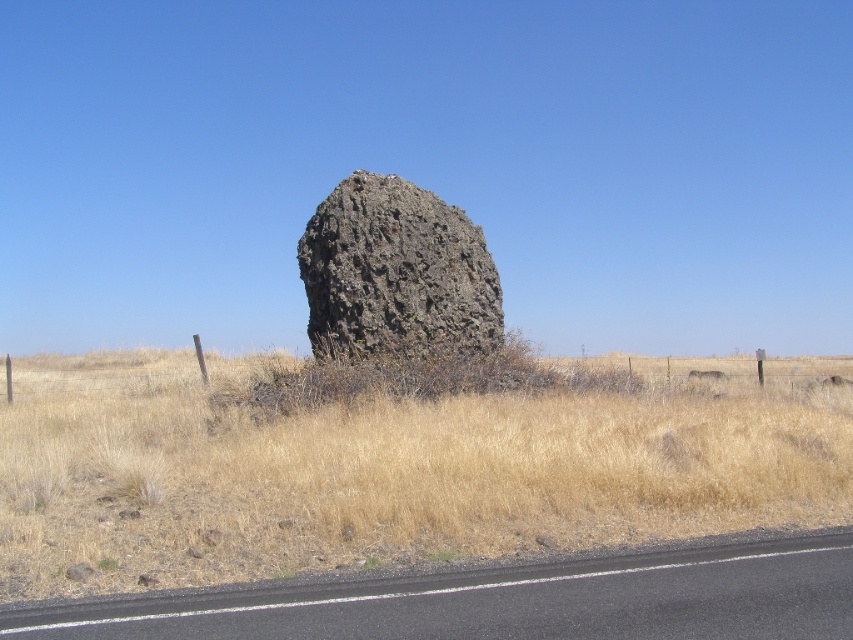
Question: Estimate the real-world distances between objects in this image. Which object is closer to the dry grass at center?

Choices:
 (A) rusty stone boulder at center
 (B) black asphalt road at lower center

Answer: (A)

Question: Can you confirm if dry grass at center is wider than black asphalt road at lower center?

Choices:
 (A) no
 (B) yes

Answer: (B)

Question: Which point is farther to the camera?

Choices:
 (A) (762, 394)
 (B) (596, 596)

Answer: (A)

Question: Considering the relative positions of dry grass at center and black asphalt road at lower center in the image provided, where is dry grass at center located with respect to black asphalt road at lower center?

Choices:
 (A) left
 (B) right

Answer: (B)

Question: Which point appears farthest from the camera in this image?

Choices:
 (A) (469, 342)
 (B) (492, 456)

Answer: (A)

Question: Is black asphalt road at lower center to the right of rusty stone boulder at center from the viewer's perspective?

Choices:
 (A) yes
 (B) no

Answer: (A)